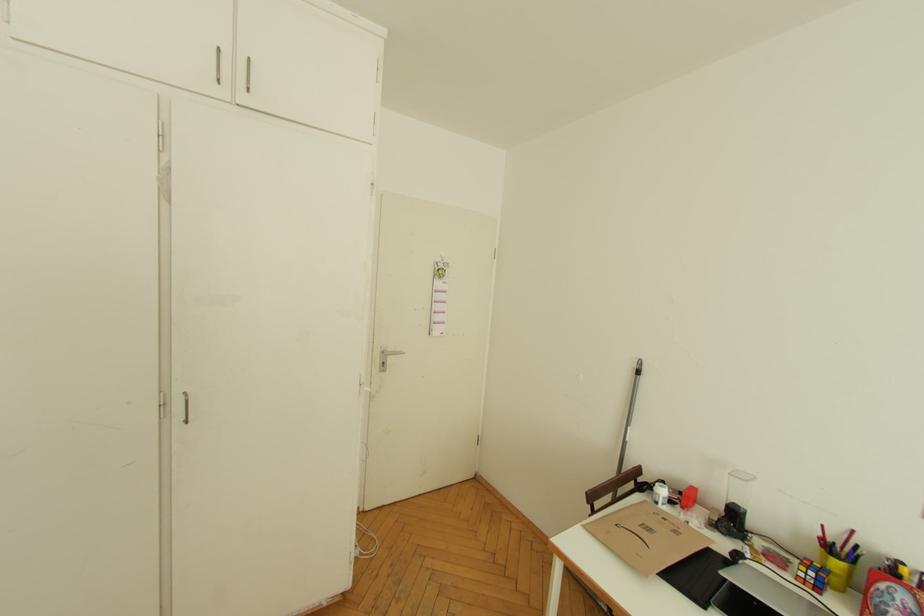
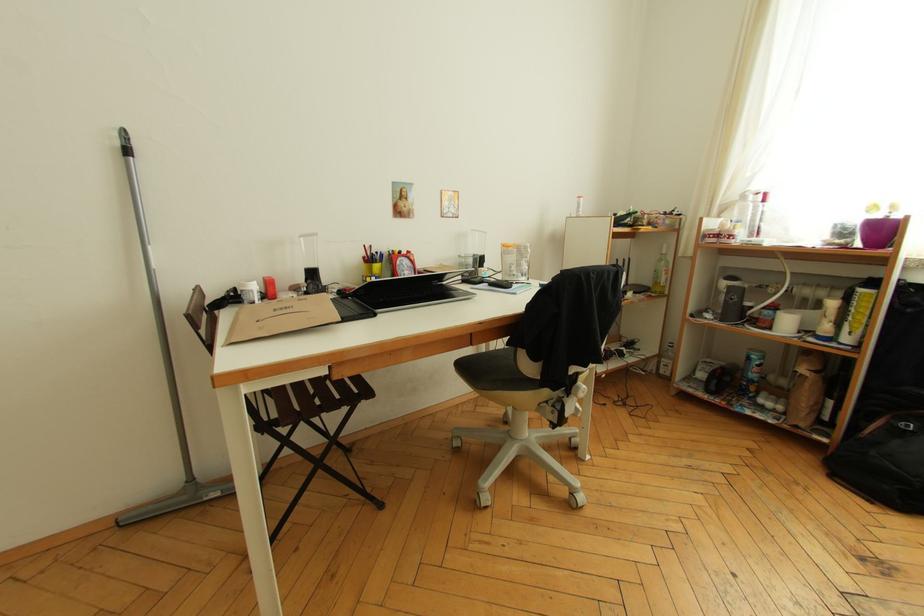
The first image is from the beginning of the video and the second image is from the end. How did the camera likely rotate when shooting the video?

The camera rotated toward right-down.